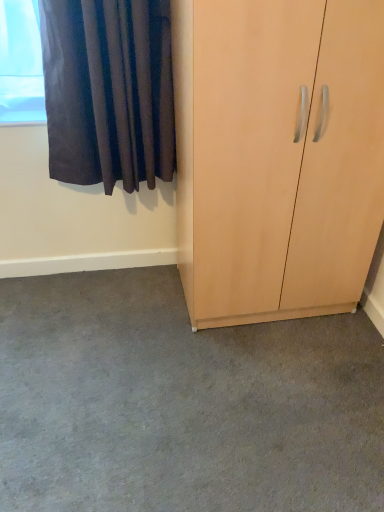
Question: Does dark velvet curtain at upper left have a greater height compared to gray carpet at lower center?

Choices:
 (A) no
 (B) yes

Answer: (B)

Question: Is gray carpet at lower center at the back of dark velvet curtain at upper left?

Choices:
 (A) no
 (B) yes

Answer: (A)

Question: Could you tell me if dark velvet curtain at upper left is facing gray carpet at lower center?

Choices:
 (A) no
 (B) yes

Answer: (A)

Question: Is dark velvet curtain at upper left bigger than gray carpet at lower center?

Choices:
 (A) no
 (B) yes

Answer: (A)

Question: Considering the relative sizes of dark velvet curtain at upper left and gray carpet at lower center in the image provided, is dark velvet curtain at upper left shorter than gray carpet at lower center?

Choices:
 (A) no
 (B) yes

Answer: (A)

Question: From the image's perspective, relative to light wood cupboard at right, is dark velvet curtain at upper left above or below?

Choices:
 (A) below
 (B) above

Answer: (B)

Question: Considering the positions of dark velvet curtain at upper left and light wood cupboard at right in the image, is dark velvet curtain at upper left bigger or smaller than light wood cupboard at right?

Choices:
 (A) small
 (B) big

Answer: (A)

Question: From a real-world perspective, is dark velvet curtain at upper left positioned above or below light wood cupboard at right?

Choices:
 (A) above
 (B) below

Answer: (A)

Question: Relative to light wood cupboard at right, is dark velvet curtain at upper left in front or behind?

Choices:
 (A) front
 (B) behind

Answer: (B)

Question: Considering the positions of gray carpet at lower center and light wood cupboard at right in the image, is gray carpet at lower center wider or thinner than light wood cupboard at right?

Choices:
 (A) wide
 (B) thin

Answer: (A)

Question: Relative to light wood cupboard at right, is gray carpet at lower center in front or behind?

Choices:
 (A) behind
 (B) front

Answer: (A)

Question: Is gray carpet at lower center inside or outside of light wood cupboard at right?

Choices:
 (A) outside
 (B) inside

Answer: (A)

Question: From the image's perspective, relative to light wood cupboard at right, is gray carpet at lower center above or below?

Choices:
 (A) below
 (B) above

Answer: (A)

Question: Is light wood cupboard at right wider or thinner than gray carpet at lower center?

Choices:
 (A) thin
 (B) wide

Answer: (A)

Question: Is light wood cupboard at right taller or shorter than gray carpet at lower center?

Choices:
 (A) short
 (B) tall

Answer: (B)